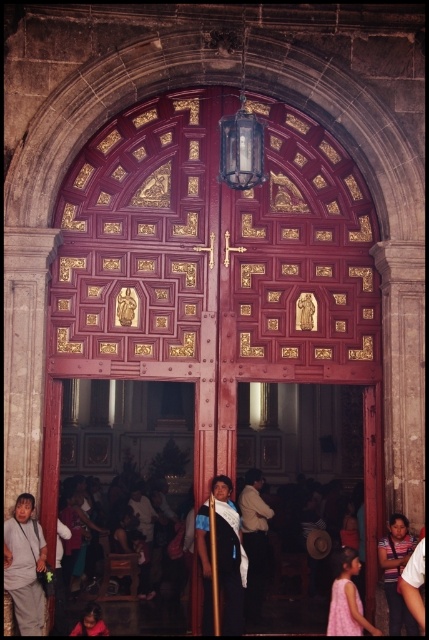
Is point (33, 600) positioned in front of point (355, 595)?

Yes.

Who is shorter, gray fabric jacket at lower left or pink satin dress at lower right?

Standing shorter between the two is pink satin dress at lower right.

Identify the location of gray fabric jacket at lower left. (24, 564).

Is polished wood door at center smaller than white cotton shirt at center?

Actually, polished wood door at center might be larger than white cotton shirt at center.

Is point (85, 344) less distant than point (254, 481)?

Yes.

Locate an element on the screen. The width and height of the screenshot is (429, 640). polished wood door at center is located at coordinates (215, 273).

Is polished wood door at center thinner than blue fabric shawl at center?

No.

Does polished wood door at center appear over blue fabric shawl at center?

Correct, polished wood door at center is located above blue fabric shawl at center.

Does point (195, 90) come behind point (226, 588)?

Yes, it is.

Identify the location of polished wood door at center. The width and height of the screenshot is (429, 640). (215, 273).